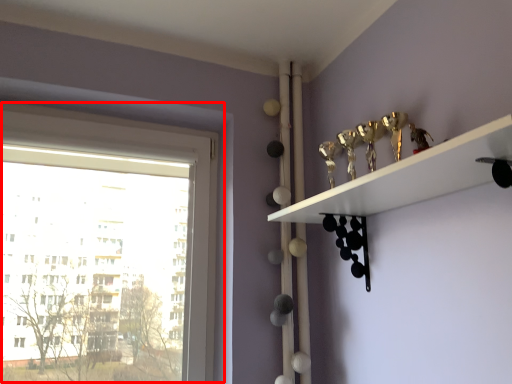
Question: Observing the image, what is the correct spatial positioning of window (annotated by the red box) in reference to shelf?

Choices:
 (A) left
 (B) right

Answer: (A)